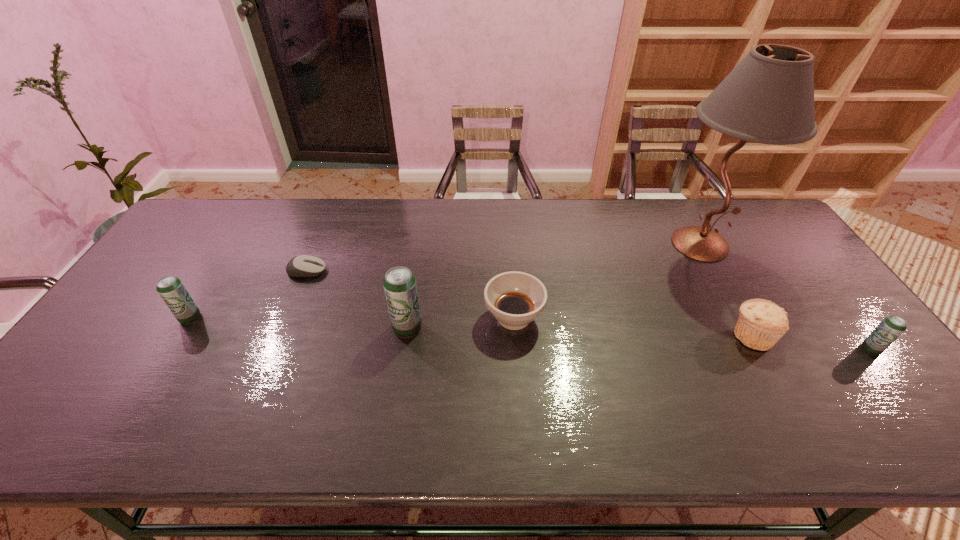
In order to click on object that is at the far edge in this screenshot , I will do `click(768, 98)`.

The width and height of the screenshot is (960, 540). Identify the location of beer can that is positioned at the right edge. (891, 327).

This screenshot has height=540, width=960. I want to click on table lamp present at the right edge, so click(x=768, y=98).

The height and width of the screenshot is (540, 960). I want to click on object at the far right corner, so click(768, 98).

Find the location of a particular element. The height and width of the screenshot is (540, 960). vacant area at the far edge is located at coordinates (350, 238).

Where is `free space at the near edge of the desktop`? This screenshot has width=960, height=540. free space at the near edge of the desktop is located at coordinates (588, 376).

In the image, there is a desktop. Where is `blank space at the left edge`? Image resolution: width=960 pixels, height=540 pixels. blank space at the left edge is located at coordinates (170, 322).

The width and height of the screenshot is (960, 540). I want to click on free point at the right edge, so click(794, 320).

This screenshot has width=960, height=540. In the image, there is a desktop. Identify the location of vacant space at the far right corner. (754, 222).

This screenshot has height=540, width=960. I want to click on vacant area that lies between the tallest object and the fourth object from right to left, so click(x=607, y=281).